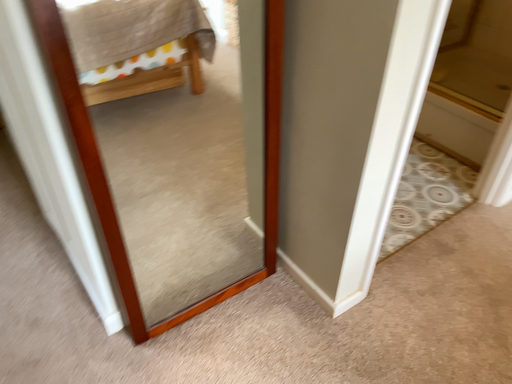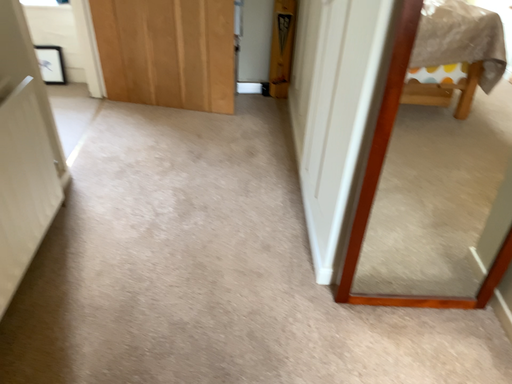
Question: How did the camera likely rotate when shooting the video?

Choices:
 (A) rotated left
 (B) rotated right

Answer: (A)